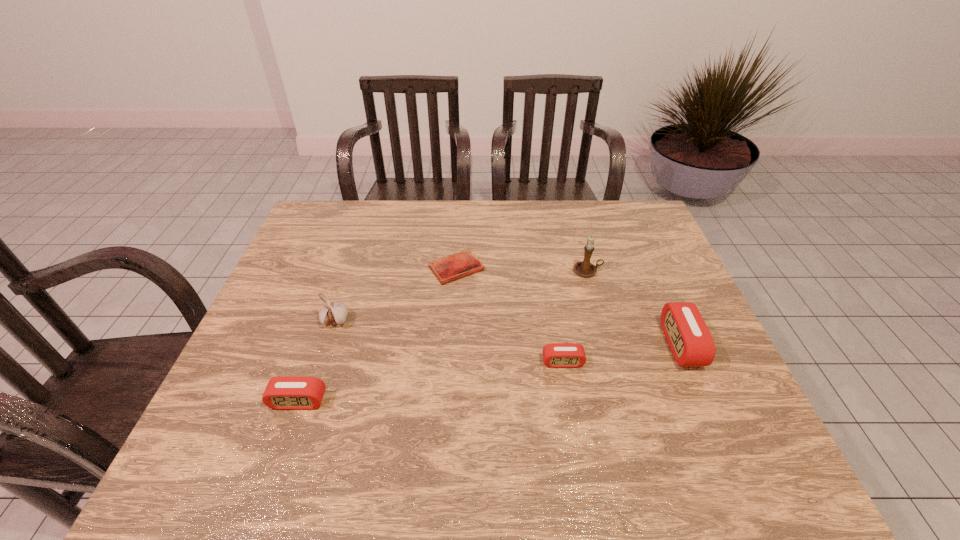
Where is `free space that is in between the diary and the garlic`? The image size is (960, 540). free space that is in between the diary and the garlic is located at coordinates (396, 294).

The width and height of the screenshot is (960, 540). Find the location of `vacant area that lies between the rightmost alarm clock and the second shortest alarm clock`. vacant area that lies between the rightmost alarm clock and the second shortest alarm clock is located at coordinates (490, 373).

Where is `free spot between the shortest object and the garlic`? The height and width of the screenshot is (540, 960). free spot between the shortest object and the garlic is located at coordinates (396, 294).

Find the location of `unoccupied area between the garlic and the third object from left to right`. unoccupied area between the garlic and the third object from left to right is located at coordinates (396, 294).

The width and height of the screenshot is (960, 540). What are the coordinates of `free space that is in between the garlic and the third object from left to right` in the screenshot? It's located at 396,294.

In order to click on vacant space that's between the fifth tallest object and the second shortest alarm clock in this screenshot , I will do pos(430,382).

The image size is (960, 540). In order to click on free space that is in between the shortest object and the rightmost alarm clock in this screenshot , I will do `click(568, 306)`.

Locate an element on the screen. the fifth closest object to the tallest object is located at coordinates (282, 393).

The height and width of the screenshot is (540, 960). I want to click on object that is the nearest to the garlic, so click(282, 393).

Image resolution: width=960 pixels, height=540 pixels. In order to click on the second closest alarm clock relative to the rightmost alarm clock in this screenshot , I will do `click(282, 393)`.